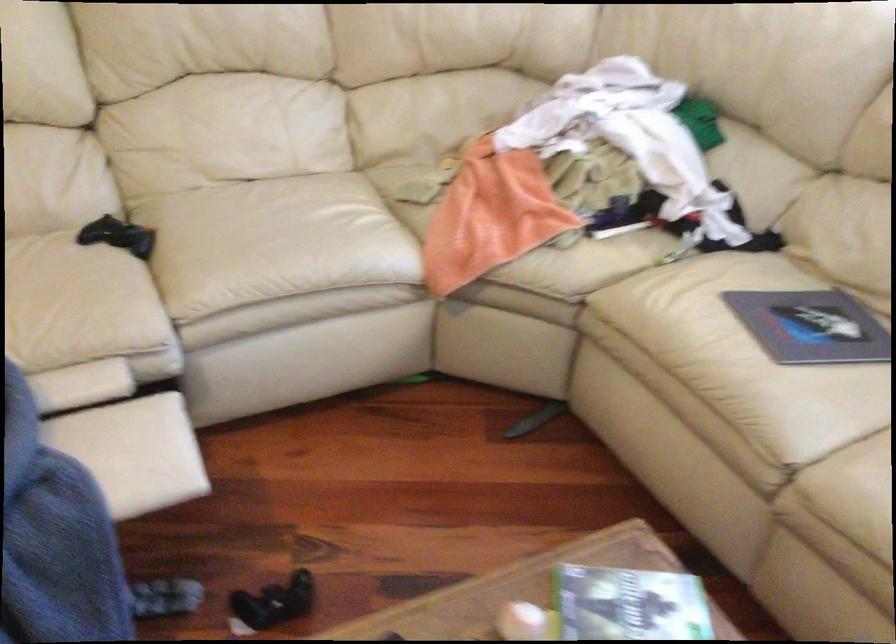
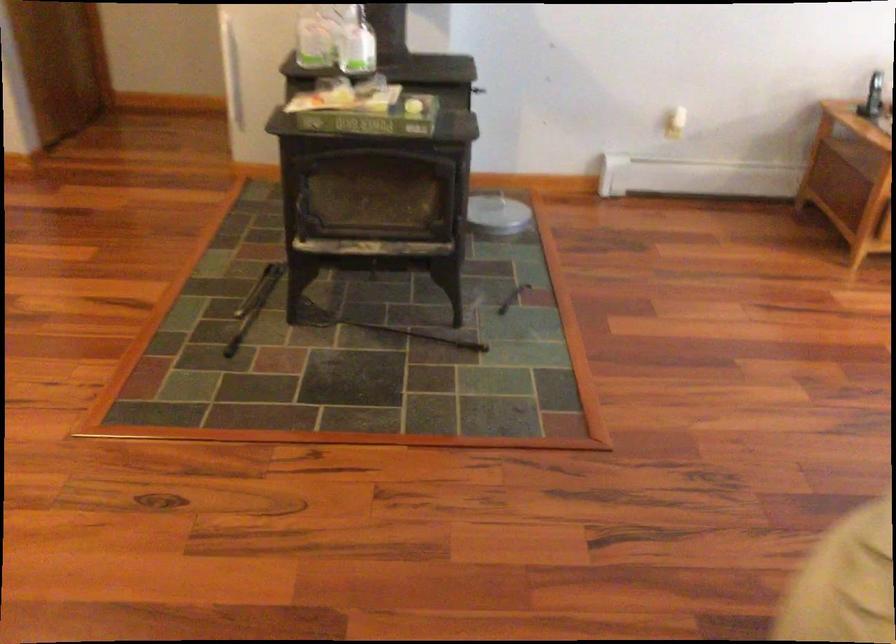
Which direction would the cameraman need to move to produce the second image?

The movement direction of the cameraman is left, forward.